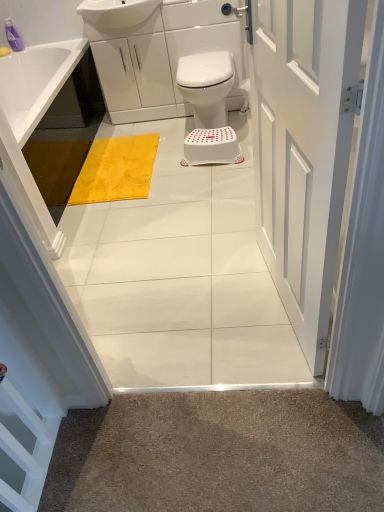
You are a GUI agent. You are given a task and a screenshot of the screen. Output one action in this format:
    pyautogui.click(x=<x>, y=<y>)
    Task: Click on the white plastic bidet at center
    
    Given the screenshot: What is the action you would take?
    pyautogui.click(x=207, y=86)

Measure the distance between white painted wood door at center and camera.

They are 28.25 inches apart.

Image resolution: width=384 pixels, height=512 pixels. What are the coordinates of `yellow plush bath mat at center` in the screenshot? It's located at [x=116, y=170].

Is translucent purple bottle at upper left situated inside white glossy sink at upper center or outside?

translucent purple bottle at upper left is not inside white glossy sink at upper center, it's outside.

Based on their positions, is translucent purple bottle at upper left located to the left or right of white glossy sink at upper center?

From the image, it's evident that translucent purple bottle at upper left is to the left of white glossy sink at upper center.

Considering the sizes of translucent purple bottle at upper left and white glossy sink at upper center in the image, is translucent purple bottle at upper left bigger or smaller than white glossy sink at upper center?

In the image, translucent purple bottle at upper left appears to be smaller than white glossy sink at upper center.

From the picture: From a real-world perspective, which is physically above, translucent purple bottle at upper left or white glossy sink at upper center?

white glossy sink at upper center is physically above.

Does white painted wood door at center touch white plastic stool at center?

white painted wood door at center and white plastic stool at center are not in contact.

Is white painted wood door at center not within white plastic stool at center?

Indeed, white painted wood door at center is completely outside white plastic stool at center.

Is white painted wood door at center turned away from white plastic stool at center?

No.

Considering the relative sizes of white painted wood door at center and white plastic stool at center in the image provided, is white painted wood door at center bigger than white plastic stool at center?

Correct, white painted wood door at center is larger in size than white plastic stool at center.

In the scene shown: Is white plastic stool at center aimed at white glossy sink at upper center?

No, white plastic stool at center is not aimed at white glossy sink at upper center.

Find the location of `stool on the right of white glossy sink at upper center`. stool on the right of white glossy sink at upper center is located at coordinates (211, 147).

Considering the sizes of white plastic stool at center and white glossy sink at upper center in the image, is white plastic stool at center bigger or smaller than white glossy sink at upper center?

white plastic stool at center is smaller than white glossy sink at upper center.

Is white plastic stool at center at the right side of white glossy sink at upper center?

Yes.

Which is correct: translucent purple bottle at upper left is inside white plastic stool at center, or outside of it?

translucent purple bottle at upper left is located beyond the bounds of white plastic stool at center.

Which is closer, [10,46] or [226,127]?

Point [10,46] appears to be farther away from the viewer than point [226,127].

Considering the relative positions of translucent purple bottle at upper left and white plastic stool at center in the image provided, is translucent purple bottle at upper left to the left or to the right of white plastic stool at center?

translucent purple bottle at upper left is positioned on white plastic stool at center's left side.

Would you say translucent purple bottle at upper left is a long distance from white plastic stool at center?

Yes, translucent purple bottle at upper left and white plastic stool at center are quite far apart.

Is white painted wood door at center completely or partially inside white plastic bidet at center?

Definitely not — white painted wood door at center is not inside white plastic bidet at center.

From a real-world perspective, is white plastic bidet at center positioned above or below white painted wood door at center?

white plastic bidet at center is situated lower than white painted wood door at center in the real world.

Does point (194, 105) appear closer or farther from the camera than point (325, 100)?

Point (194, 105) is positioned farther from the camera compared to point (325, 100).

Is white plastic stool at center behind white plastic bidet at center?

Yes, white plastic stool at center is further from the viewer.

From the image's perspective, is white plastic stool at center above or below white plastic bidet at center?

white plastic stool at center is below white plastic bidet at center.

Considering the relative sizes of white plastic stool at center and white plastic bidet at center in the image provided, is white plastic stool at center shorter than white plastic bidet at center?

Indeed, white plastic stool at center has a lesser height compared to white plastic bidet at center.

Is white plastic stool at center spatially inside white plastic bidet at center, or outside of it?

white plastic stool at center is outside white plastic bidet at center.

Does yellow plush bath mat at center appear on the right side of white painted wood door at center?

Incorrect, yellow plush bath mat at center is not on the right side of white painted wood door at center.

Who is bigger, yellow plush bath mat at center or white painted wood door at center?

Bigger between the two is white painted wood door at center.

Based on the photo, from the image's perspective, is yellow plush bath mat at center located above or below white painted wood door at center?

Clearly, from the image's perspective, yellow plush bath mat at center is above white painted wood door at center.

You are a GUI agent. You are given a task and a screenshot of the screen. Output one action in this format:
    pyautogui.click(x=<x>, y=<y>)
    Task: Click on the toiletry located underneath the white glossy sink at upper center (from a real-world perspective)
    Image resolution: width=384 pixels, height=512 pixels.
    Given the screenshot: What is the action you would take?
    pyautogui.click(x=13, y=36)

Locate an element on the screen. door that appears on the right of white plastic stool at center is located at coordinates (303, 148).

Which object lies nearer to the anchor point white painted wood door at center, white glossy sink at upper center or white plastic bidet at center?

Among the two, white plastic bidet at center is located nearer to white painted wood door at center.

Considering their positions, is white plastic stool at center positioned further to white plastic bidet at center than translucent purple bottle at upper left?

translucent purple bottle at upper left lies further to white plastic bidet at center than the other object.

Which object lies further to the anchor point white glossy sink at upper center, white plastic stool at center or yellow plush bath mat at center?

Among the two, white plastic stool at center is located further to white glossy sink at upper center.

Estimate the real-world distances between objects in this image. Which object is closer to white plastic bidet at center, translucent purple bottle at upper left or white plastic stool at center?

Among the two, white plastic stool at center is located nearer to white plastic bidet at center.

When comparing their distances from translucent purple bottle at upper left, does white plastic bidet at center or white plastic stool at center seem further?

white plastic stool at center is further to translucent purple bottle at upper left.

Looking at this image, from the image, which object appears to be nearer to yellow plush bath mat at center, white plastic bidet at center or translucent purple bottle at upper left?

white plastic bidet at center is closer to yellow plush bath mat at center.

Consider the image. Which object lies further to the anchor point white glossy sink at upper center, white painted wood door at center or white plastic stool at center?

white painted wood door at center is positioned further to the anchor white glossy sink at upper center.

Looking at the image, which one is located closer to white plastic stool at center, translucent purple bottle at upper left or white plastic bidet at center?

white plastic bidet at center.

Identify the location of stool between white glossy sink at upper center and yellow plush bath mat at center in the up-down direction. The width and height of the screenshot is (384, 512). (211, 147).

Locate an element on the screen. The height and width of the screenshot is (512, 384). bidet that lies between white glossy sink at upper center and white plastic stool at center from top to bottom is located at coordinates (207, 86).

The width and height of the screenshot is (384, 512). I want to click on bidet between white painted wood door at center and white glossy sink at upper center along the z-axis, so click(207, 86).

Identify the location of bath mat between translucent purple bottle at upper left and white plastic bidet at center. (116, 170).